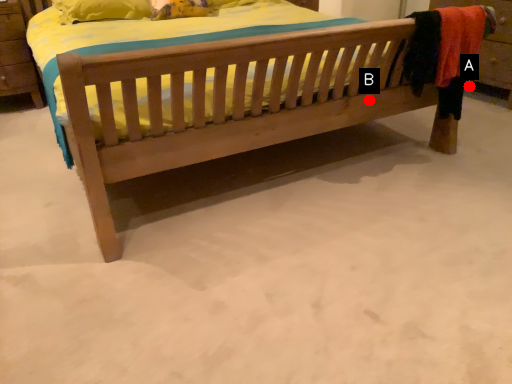
Question: Two points are circled on the image, labeled by A and B beside each circle. Which point is farther to the camera?

Choices:
 (A) A is further
 (B) B is further

Answer: (A)